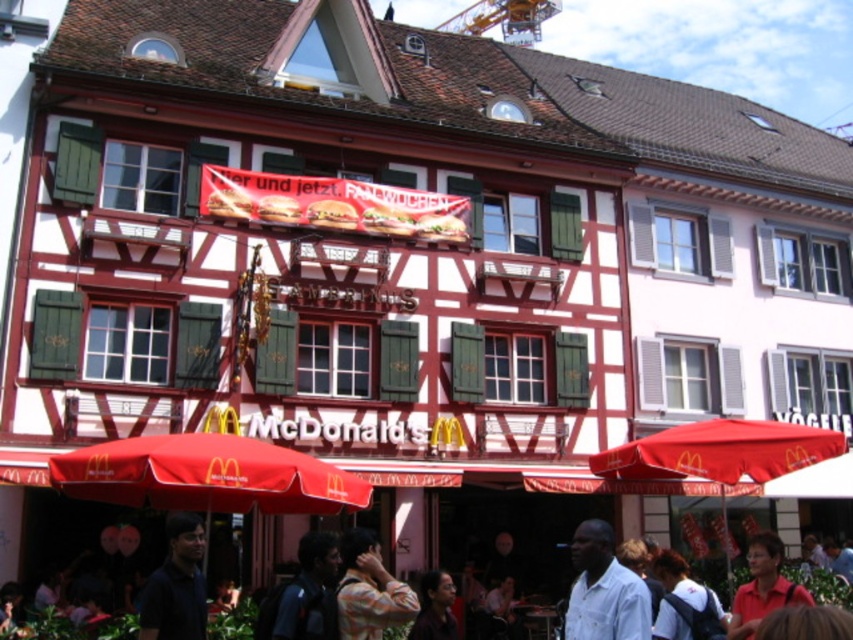
Does plaid shirt at center appear on the left side of yellow metallic crane at upper center?

Yes, plaid shirt at center is to the left of yellow metallic crane at upper center.

Which of these two, plaid shirt at center or yellow metallic crane at upper center, stands shorter?

With less height is plaid shirt at center.

Which is in front, point (381, 630) or point (514, 29)?

Point (381, 630)

This screenshot has height=640, width=853. I want to click on plaid shirt at center, so click(x=369, y=589).

Between white cotton shirt at center and yellow metallic crane at upper center, which one has less height?

With less height is white cotton shirt at center.

The width and height of the screenshot is (853, 640). What do you see at coordinates (604, 589) in the screenshot? I see `white cotton shirt at center` at bounding box center [604, 589].

Between point (608, 554) and point (540, 24), which one is positioned in front?

Point (608, 554)

You are a GUI agent. You are given a task and a screenshot of the screen. Output one action in this format:
    pyautogui.click(x=<x>, y=<y>)
    Task: Click on the white cotton shirt at center
    
    Given the screenshot: What is the action you would take?
    pyautogui.click(x=604, y=589)

Which is behind, point (759, 435) or point (305, 536)?

The point (759, 435) is more distant.

Who is shorter, red fabric umbrella at lower right or dark blue shirt at lower center?

With less height is dark blue shirt at lower center.

Between point (746, 445) and point (302, 618), which one is positioned behind?

Positioned behind is point (746, 445).

Find the location of a particular element. This screenshot has width=853, height=640. red fabric umbrella at lower right is located at coordinates (720, 451).